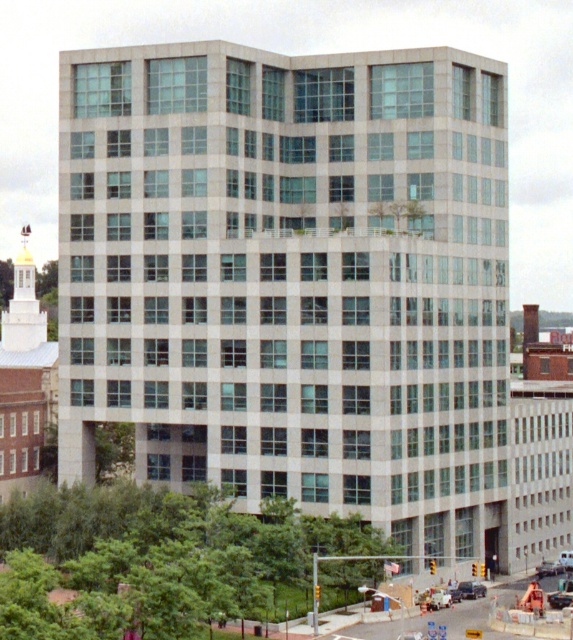
Question: Based on their relative distances, which object is nearer to the white matte car at center?

Choices:
 (A) metallic silver car at lower right
 (B) metallic silver sedan at center
 (C) metallic silver sedan at lower right

Answer: (B)

Question: Is metallic silver sedan at center wider than metallic silver car at lower right?

Choices:
 (A) yes
 (B) no

Answer: (B)

Question: Which of the following is the closest to the observer?

Choices:
 (A) (555, 563)
 (B) (563, 557)
 (C) (466, 596)

Answer: (C)

Question: Is metallic silver sedan at lower right smaller than white matte car at center?

Choices:
 (A) no
 (B) yes

Answer: (A)

Question: Which object is the closest to the metallic silver car at lower right?

Choices:
 (A) metallic silver sedan at lower right
 (B) metallic silver sedan at center
 (C) white matte car at center

Answer: (A)

Question: Can you confirm if metallic silver sedan at center is positioned above metallic silver sedan at lower right?

Choices:
 (A) yes
 (B) no

Answer: (A)